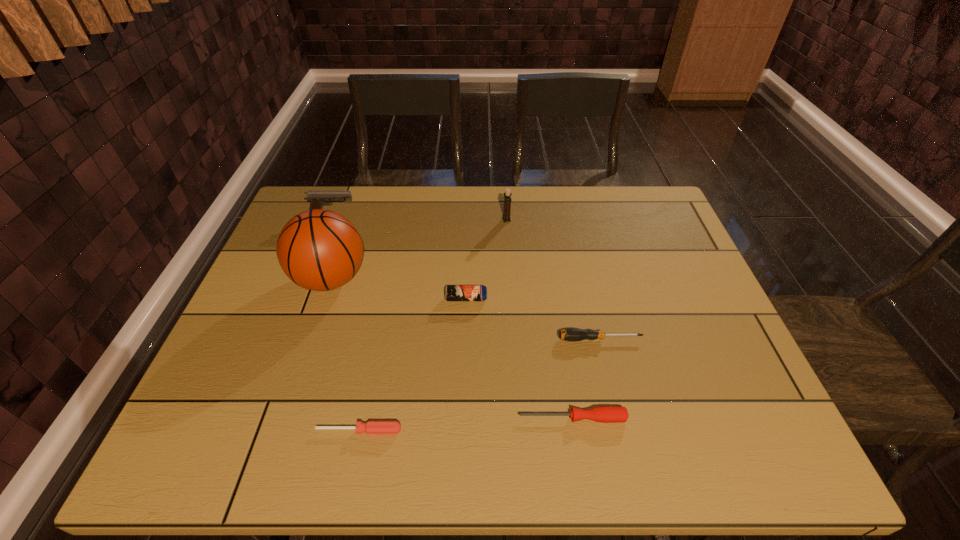
Locate an element on the screen. The height and width of the screenshot is (540, 960). object that ranks as the sixth closest to the second nearest object is located at coordinates (316, 198).

Identify which screwdriver is the second closest to the fifth shortest object. Please provide its 2D coordinates. Your answer should be formatted as a tuple, i.e. [(x, y)], where the tuple contains the x and y coordinates of a point satisfying the conditions above.

[(572, 334)]

Point out which screwdriver is positioned as the second nearest to the fifth tallest object. Please provide its 2D coordinates. Your answer should be formatted as a tuple, i.e. [(x, y)], where the tuple contains the x and y coordinates of a point satisfying the conditions above.

[(371, 427)]

Identify the location of vacant point that satisfies the following two spatial constraints: 1. at the barrel of the fourth shortest object; 2. on the left side of the pistol. (300, 299).

Where is `free space that satisfies the following two spatial constraints: 1. at the barrel of the fifth shortest object; 2. on the back side of the fourth tallest object`? This screenshot has width=960, height=540. free space that satisfies the following two spatial constraints: 1. at the barrel of the fifth shortest object; 2. on the back side of the fourth tallest object is located at coordinates (300, 299).

I want to click on vacant position in the image that satisfies the following two spatial constraints: 1. at the barrel of the third tallest object; 2. on the back side of the sixth shortest object, so click(331, 219).

The height and width of the screenshot is (540, 960). Find the location of `free spot that satisfies the following two spatial constraints: 1. at the barrel of the third shortest object; 2. on the right side of the third tallest object`. free spot that satisfies the following two spatial constraints: 1. at the barrel of the third shortest object; 2. on the right side of the third tallest object is located at coordinates (284, 339).